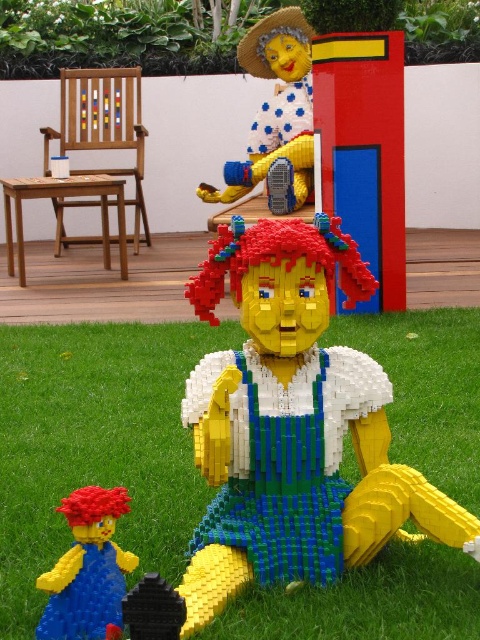
Is green grass at lower center closer to camera compared to brick-patterned toy at lower left?

That is False.

Can you confirm if green grass at lower center is positioned above brick-patterned toy at lower left?

Correct, green grass at lower center is located above brick-patterned toy at lower left.

The width and height of the screenshot is (480, 640). I want to click on green grass at lower center, so click(x=96, y=444).

Find the location of a particular element. The height and width of the screenshot is (640, 480). green grass at lower center is located at coordinates (96, 444).

Is point (423, 385) positioned before point (305, 196)?

Yes, point (423, 385) is in front of point (305, 196).

Between point (336, 602) and point (296, 26), which one is positioned in front?

Positioned in front is point (336, 602).

The height and width of the screenshot is (640, 480). Describe the element at coordinates (96, 444) in the screenshot. I see `green grass at lower center` at that location.

Identify the location of green grass at lower center. (96, 444).

Locate an element on the screen. matte yellow plastic figure at upper center is located at coordinates pyautogui.click(x=276, y=115).

Is matte yellow plastic figure at upper center to the right of brick-patterned toy at lower left from the viewer's perspective?

Yes, matte yellow plastic figure at upper center is to the right of brick-patterned toy at lower left.

What are the coordinates of `matte yellow plastic figure at upper center` in the screenshot? It's located at (276, 115).

Locate an element on the screen. This screenshot has width=480, height=640. matte yellow plastic figure at upper center is located at coordinates 276,115.